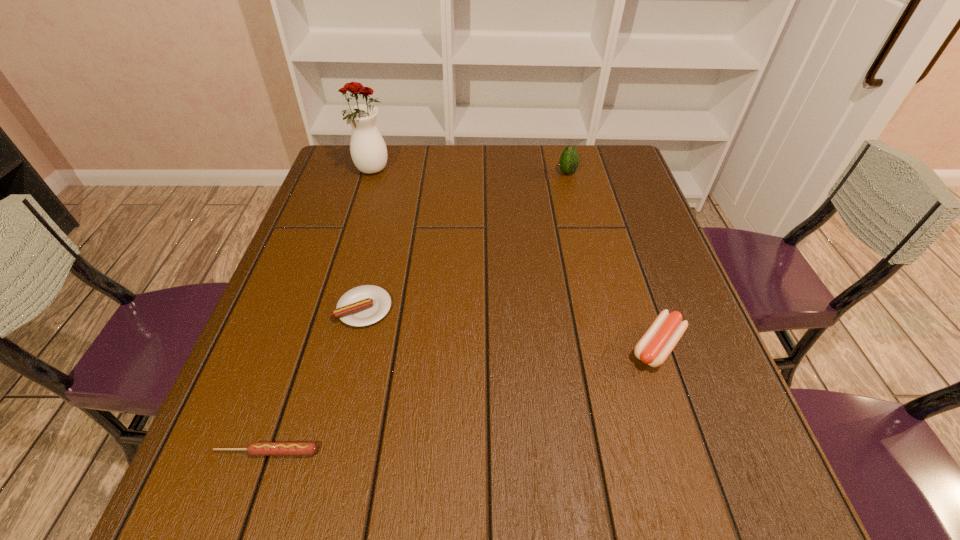
In order to click on free spot that satisfies the following two spatial constraints: 1. on the back side of the nearest sausage; 2. on the left side of the fourth shortest object in this screenshot , I will do `click(361, 173)`.